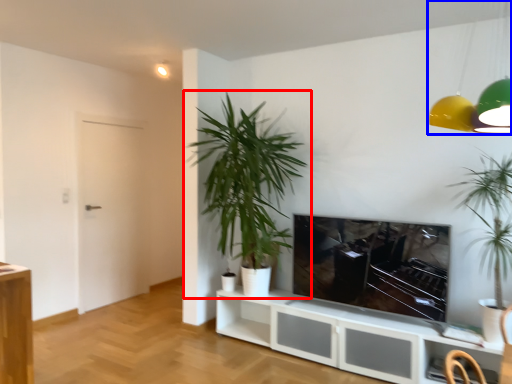
Question: Which point is closer to the camera, houseplant (highlighted by a red box) or lamp (highlighted by a blue box)?

Choices:
 (A) houseplant
 (B) lamp

Answer: (B)